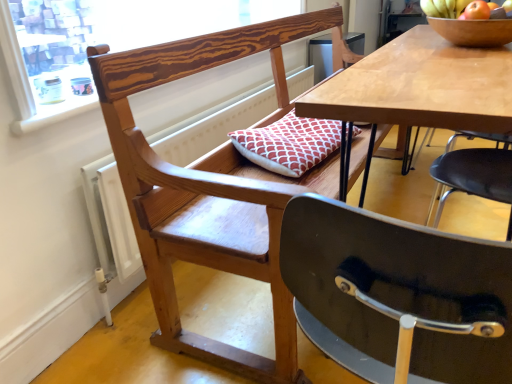
What do you see at coordinates (110, 219) in the screenshot? The image size is (512, 384). I see `wooden radiator at left` at bounding box center [110, 219].

The image size is (512, 384). I want to click on wooden bowl at upper right, so click(473, 31).

Where is `wooden chair with cushion at center`? The height and width of the screenshot is (384, 512). wooden chair with cushion at center is located at coordinates (210, 189).

This screenshot has width=512, height=384. Find the location of `wooden radiator at left`. wooden radiator at left is located at coordinates (110, 219).

Who is smaller, wooden chair with cushion at center or wooden bowl at upper right?

wooden bowl at upper right is smaller.

Can you confirm if wooden chair with cushion at center is taller than wooden bowl at upper right?

Yes.

Is there a large distance between wooden chair with cushion at center and wooden bowl at upper right?

No, wooden chair with cushion at center is not far away from wooden bowl at upper right.

Is wooden frame at upper left further to the viewer compared to shiny golden bananas at upper right?

No.

From a real-world perspective, is wooden frame at upper left positioned above or below shiny golden bananas at upper right?

wooden frame at upper left is below shiny golden bananas at upper right.

Does wooden frame at upper left have a greater width compared to shiny golden bananas at upper right?

Yes.

Between wooden frame at upper left and wooden chair with cushion at center, which one has more height?

Standing taller between the two is wooden chair with cushion at center.

Does wooden frame at upper left have a greater width compared to wooden chair with cushion at center?

No.

Is wooden frame at upper left situated inside wooden chair with cushion at center or outside?

The correct answer is: outside.

Does wooden bowl at upper right have a greater width compared to wooden frame at upper left?

Correct, the width of wooden bowl at upper right exceeds that of wooden frame at upper left.

Is there a large distance between wooden bowl at upper right and wooden frame at upper left?

Yes, wooden bowl at upper right is far from wooden frame at upper left.

Would you say wooden frame at upper left is part of wooden bowl at upper right's contents?

No, wooden frame at upper left is not a part of wooden bowl at upper right.

In the scene shown: Is wooden bowl at upper right behind wooden frame at upper left?

Yes.

Is point (462, 0) positioned before point (116, 26)?

Yes, point (462, 0) is in front of point (116, 26).

In the scene shown: Is shiny golden bananas at upper right further to camera compared to wooden frame at upper left?

Yes.

Can we say shiny golden bananas at upper right lies outside wooden frame at upper left?

Yes, shiny golden bananas at upper right is outside of wooden frame at upper left.

In the scene shown: Does shiny golden bananas at upper right have a larger size compared to wooden frame at upper left?

Incorrect, shiny golden bananas at upper right is not larger than wooden frame at upper left.

Would you say wooden radiator at left is to the left or to the right of wooden frame at upper left in the picture?

From the image, it's evident that wooden radiator at left is to the right of wooden frame at upper left.

Is wooden radiator at left oriented away from wooden frame at upper left?

wooden radiator at left does not have its back to wooden frame at upper left.

Looking at this image, can you confirm if wooden radiator at left is taller than wooden frame at upper left?

Indeed, wooden radiator at left has a greater height compared to wooden frame at upper left.

From the picture: Is wooden radiator at left not near wooden frame at upper left?

wooden radiator at left is positioned a significant distance from wooden frame at upper left.

Can wooden radiator at left be found inside wooden bowl at upper right?

No, wooden radiator at left is not a part of wooden bowl at upper right.

Image resolution: width=512 pixels, height=384 pixels. In order to click on bowl behind the wooden radiator at left in this screenshot , I will do `click(473, 31)`.

Between wooden bowl at upper right and wooden radiator at left, which one has larger size?

Bigger between the two is wooden radiator at left.

What's the angular difference between wooden bowl at upper right and wooden radiator at left's facing directions?

The angle between the facing direction of wooden bowl at upper right and the facing direction of wooden radiator at left is 4.19 degrees.

The width and height of the screenshot is (512, 384). Find the location of `bowl lying behind the wooden chair with cushion at center`. bowl lying behind the wooden chair with cushion at center is located at coordinates (473, 31).

At what (x,y) coordinates should I click in order to perform the action: click on window that appears below the shiny golden bananas at upper right (from a real-world perspective). Please return your answer as a coordinate pair (x, y). Image resolution: width=512 pixels, height=384 pixels. Looking at the image, I should click on pyautogui.click(x=101, y=42).

From the image, which object appears to be nearer to shiny golden bananas at upper right, wooden bowl at upper right or wooden radiator at left?

The object closer to shiny golden bananas at upper right is wooden bowl at upper right.

Based on the photo, considering their positions, is wooden bowl at upper right positioned further to wooden frame at upper left than wooden radiator at left?

Based on the image, wooden bowl at upper right appears to be further to wooden frame at upper left.

Which object lies nearer to the anchor point shiny golden bananas at upper right, wooden frame at upper left or wooden bowl at upper right?

The object closer to shiny golden bananas at upper right is wooden bowl at upper right.

Consider the image. When comparing their distances from wooden chair with cushion at center, does shiny golden bananas at upper right or wooden bowl at upper right seem further?

shiny golden bananas at upper right.

Considering their positions, is wooden frame at upper left positioned further to shiny golden bananas at upper right than wooden chair with cushion at center?

wooden frame at upper left lies further to shiny golden bananas at upper right than the other object.

When comparing their distances from wooden frame at upper left, does wooden chair with cushion at center or shiny golden bananas at upper right seem further?

Among the two, shiny golden bananas at upper right is located further to wooden frame at upper left.

Considering their positions, is wooden chair with cushion at center positioned further to wooden radiator at left than shiny golden bananas at upper right?

Based on the image, shiny golden bananas at upper right appears to be further to wooden radiator at left.

Considering their positions, is wooden chair with cushion at center positioned closer to wooden frame at upper left than wooden bowl at upper right?

wooden chair with cushion at center is closer to wooden frame at upper left.

Find the location of a particular element. bowl between wooden chair with cushion at center and shiny golden bananas at upper right in the front-back direction is located at coordinates (473, 31).

The height and width of the screenshot is (384, 512). Identify the location of chair between wooden radiator at left and shiny golden bananas at upper right in the horizontal direction. [210, 189].

I want to click on fruit between wooden frame at upper left and wooden bowl at upper right, so click(x=454, y=8).

Identify the location of radiator located between wooden frame at upper left and wooden chair with cushion at center in the left-right direction. This screenshot has height=384, width=512. (110, 219).